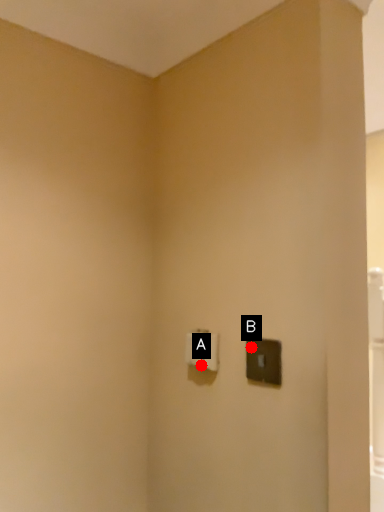
Question: Two points are circled on the image, labeled by A and B beside each circle. Which point is closer to the camera?

Choices:
 (A) A is closer
 (B) B is closer

Answer: (B)